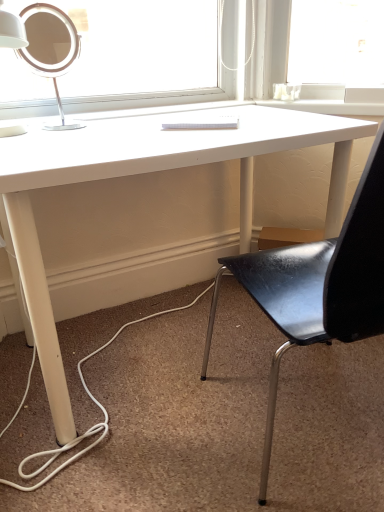
This screenshot has height=512, width=384. I want to click on free space that is in between white matte desk at center and black leather chair at center, so (188, 448).